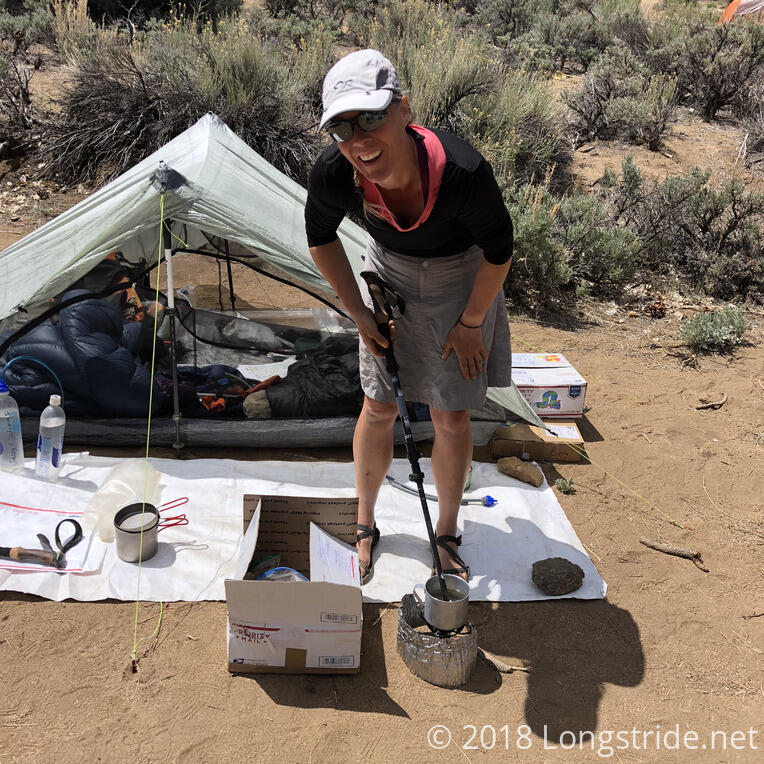
Where is `box`? This screenshot has width=764, height=764. box is located at coordinates (267, 594), (266, 646).